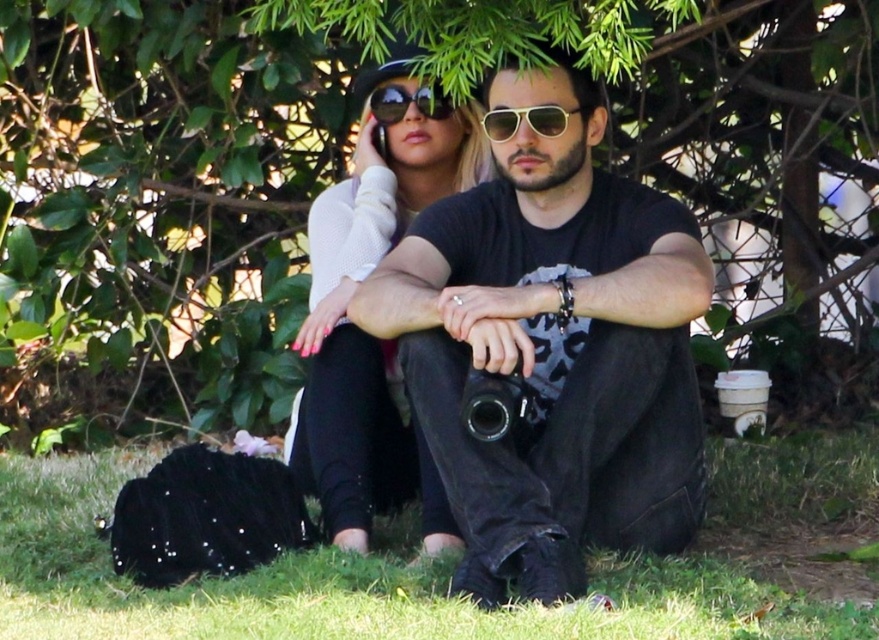
Who is more forward, (362, 173) or (513, 124)?

Positioned in front is point (513, 124).

Which is behind, point (405, 156) or point (521, 108)?

The point (405, 156) is behind.

Identify the location of matte white sweater at center. (361, 330).

Does green grass at lower center have a greater width compared to matte white sweater at center?

Yes.

Is green grass at lower center to the right of matte white sweater at center from the viewer's perspective?

In fact, green grass at lower center is to the left of matte white sweater at center.

Is point (796, 595) farther from viewer compared to point (317, 445)?

No, it is in front of (317, 445).

Where is `green grass at lower center`? green grass at lower center is located at coordinates [x=449, y=563].

Can you confirm if green grass at lower center is positioned above gold reflective aviator sunglasses at center?

No, green grass at lower center is not above gold reflective aviator sunglasses at center.

Is green grass at lower center positioned in front of gold reflective aviator sunglasses at center?

Yes, green grass at lower center is closer to the viewer.

Is point (97, 506) positioned behind point (546, 118)?

That is True.

You are a GUI agent. You are given a task and a screenshot of the screen. Output one action in this format:
    pyautogui.click(x=<x>, y=<y>)
    Task: Click on the green grass at lower center
    This screenshot has width=879, height=640.
    Given the screenshot: What is the action you would take?
    pyautogui.click(x=449, y=563)